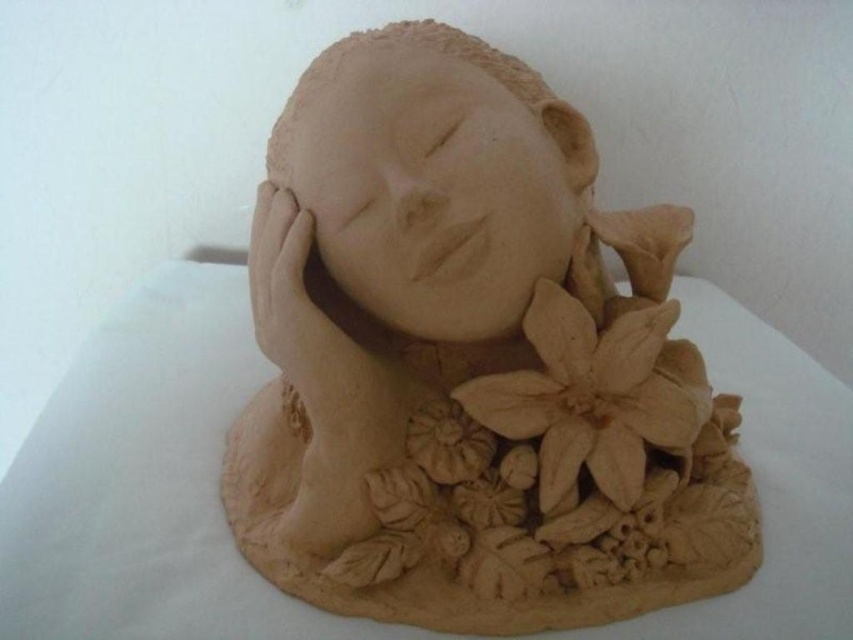
You are a photographer setting up a shot of the clay sculpture. You want to focus on the point at coordinates point (x=317, y=148). If your camera has a depth of field that can clearly capture objects within 35 inches to 40 inches from it, will the point be in focus?

The distance of point (x=317, y=148) from the camera is 37.59 inches, which falls within the depth of field range of 35 inches to 40 inches. Therefore, the point will be in focus.

You are an art conservator examining the clay sculpture. You notice two points on the sculpture labeled as point 1 at coordinates point (463, 148) and point 2 at coordinates point (410, 424). Which point is closer to the camera?

Point (463, 148) is closer to the camera than point (410, 424).